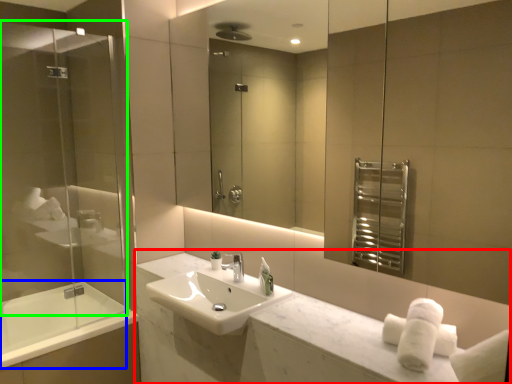
Question: Which object is positioned closest to counter (highlighted by a red box)? Select from bath (highlighted by a blue box) and screen door (highlighted by a green box).

Choices:
 (A) bath
 (B) screen door

Answer: (A)